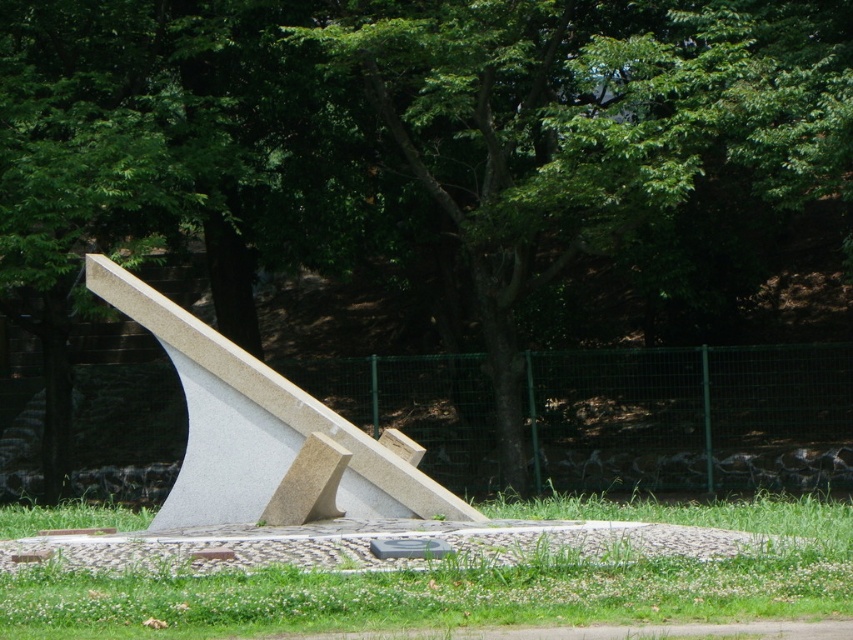
You are standing in the park and see the modern stone sculpture. There is a point marked at coordinates (471, 582). What is located at that point?

The point at coordinates (471, 582) indicates green grass at center.

You are a gardener who needs to mow the lawn. You see the green grass at center and the gray polished stone sundial at center. Which object should you avoid mowing over to prevent damage?

You should avoid mowing over the gray polished stone sundial at center because the green grass at center is in front of it, meaning the sundial is behind and less likely to be in the direct path of mowing. However, ensure to avoid the sundial itself to prevent damage to the stone structure.

You are standing at the edge of the grassy area and want to place a small decorative stone exactly where the green grass at center is located. According to the coordinates provided, what are the exact coordinates where you should place the stone?

The green grass at center is located at point (471, 582), so you should place the small decorative stone at those exact coordinates.